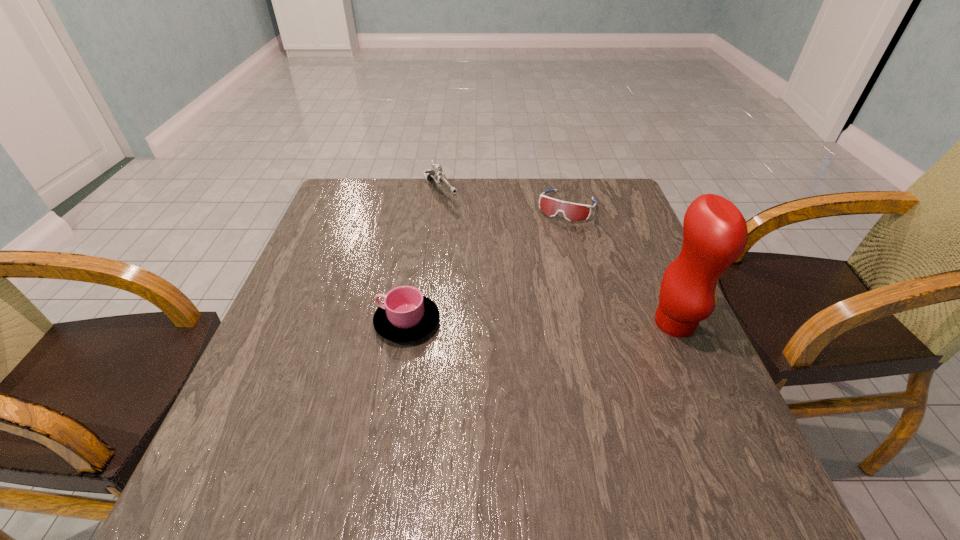
Where is `cup`? cup is located at coordinates (406, 315).

Find the location of a particular element. The width and height of the screenshot is (960, 540). condiment is located at coordinates (715, 234).

Find the location of `the tallest object`. the tallest object is located at coordinates [715, 234].

Identify the location of the third object from left to right. (572, 212).

This screenshot has height=540, width=960. I want to click on gun, so click(x=436, y=173).

The image size is (960, 540). Identify the location of vacant space situated 0.090m on the side with the handle of the cup. (334, 322).

Locate an element on the screen. vacant space located on the side with the handle of the cup is located at coordinates (334, 322).

You are a GUI agent. You are given a task and a screenshot of the screen. Output one action in this format:
    pyautogui.click(x=<x>, y=<y>)
    Task: Click on the vacant region located on the side with the handle of the cup
    Image resolution: width=960 pixels, height=540 pixels.
    Given the screenshot: What is the action you would take?
    pyautogui.click(x=324, y=322)

Locate an element on the screen. vacant space located on the front-facing side of the second object from right to left is located at coordinates (516, 303).

Find the location of a particular element. The image size is (960, 540). free point located 0.370m on the front-facing side of the second object from right to left is located at coordinates (513, 309).